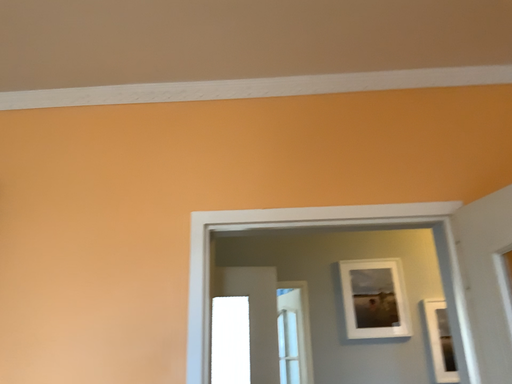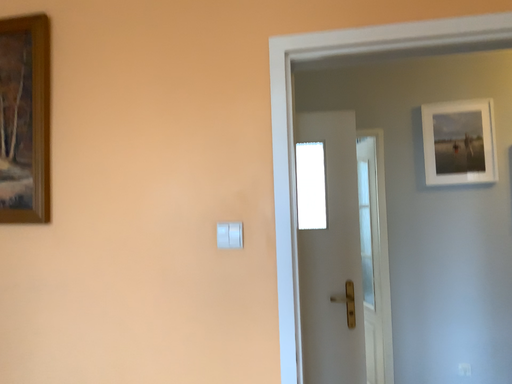
Question: Which way did the camera rotate in the video?

Choices:
 (A) rotated left
 (B) rotated right

Answer: (A)